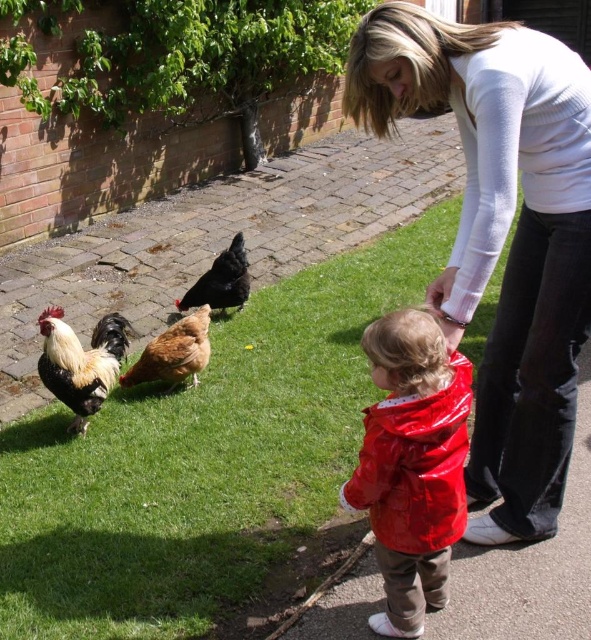
Question: Is shiny red raincoat at lower right above brown feathered chicken at center?

Choices:
 (A) yes
 (B) no

Answer: (B)

Question: Which object appears closest to the camera in this image?

Choices:
 (A) black matte chicken at center
 (B) shiny red raincoat at lower right

Answer: (B)

Question: Among these objects, which one is farthest from the camera?

Choices:
 (A) shiny red raincoat at lower right
 (B) green grass at lower center

Answer: (B)

Question: In this image, where is green grass at lower center located relative to shiny red raincoat at lower right?

Choices:
 (A) below
 (B) above

Answer: (B)

Question: Can you confirm if shiny red raincoat at lower right is smaller than golden brown feathers at center?

Choices:
 (A) no
 (B) yes

Answer: (B)

Question: Considering the real-world distances, which object is farthest from the white sweater at upper center?

Choices:
 (A) black matte chicken at center
 (B) golden brown feathers at center

Answer: (A)